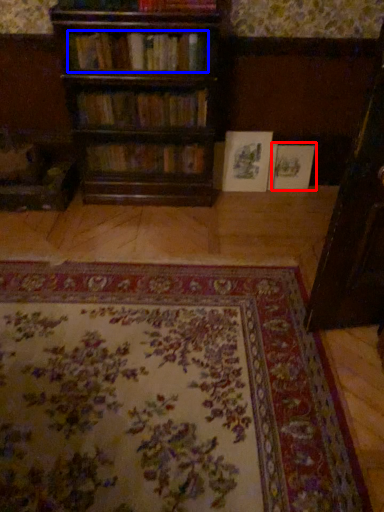
Question: Which point is closer to the camera, book (highlighted by a red box) or book (highlighted by a blue box)?

Choices:
 (A) book
 (B) book

Answer: (B)